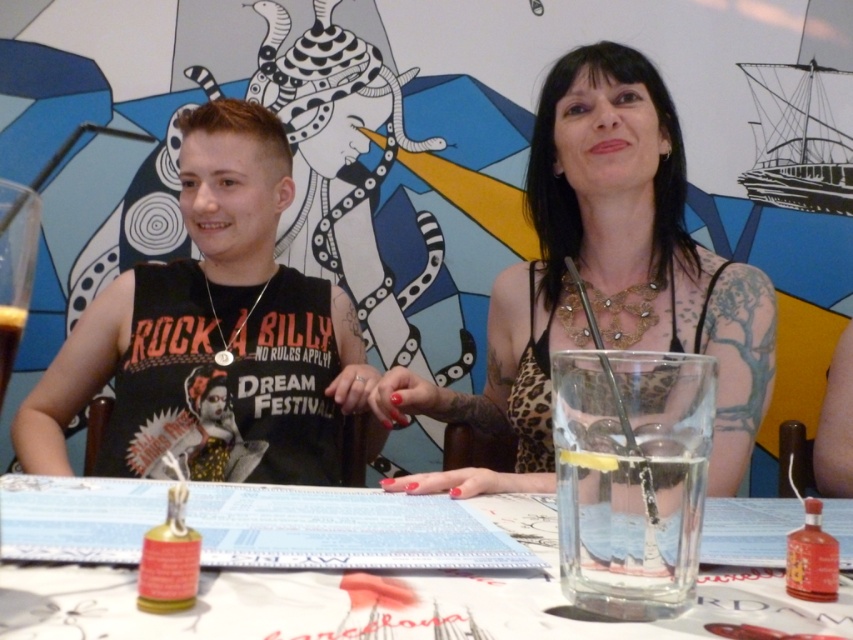
Is black matte tank top at left taller than leopard print dress at center?

Yes, black matte tank top at left is taller than leopard print dress at center.

Is black matte tank top at left above leopard print dress at center?

No, black matte tank top at left is not above leopard print dress at center.

The image size is (853, 640). I want to click on black matte tank top at left, so click(212, 333).

Can you confirm if black matte tank top at left is positioned to the left of clear glass at left?

Yes, black matte tank top at left is to the left of clear glass at left.

Is point (213, 138) positioned in front of point (6, 324)?

No, (213, 138) is further to viewer.

Measure the distance between black matte tank top at left and camera.

black matte tank top at left is 1.14 meters from camera.

Identify the location of black matte tank top at left. (212, 333).

Can you confirm if black matte tank top at left is smaller than clear plastic glass at center?

No, black matte tank top at left is not smaller than clear plastic glass at center.

Between black matte tank top at left and clear plastic glass at center, which one is positioned lower?

clear plastic glass at center is below.

Does point (107, 460) come closer to viewer compared to point (546, 611)?

No, it is not.

Where is `black matte tank top at left`? The image size is (853, 640). black matte tank top at left is located at coordinates (212, 333).